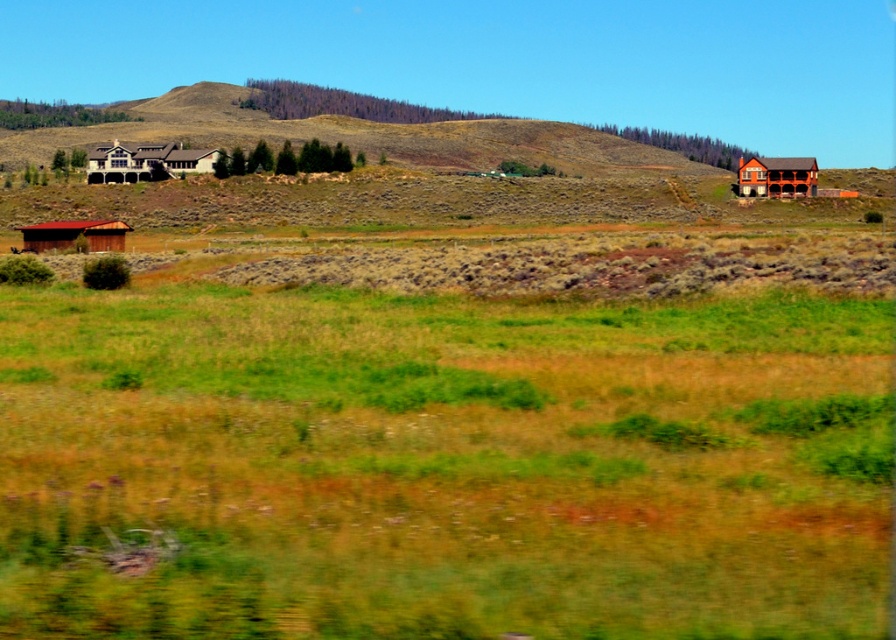
Does point (113, 180) lie in front of point (65, 228)?

No, (113, 180) is further to viewer.

Which of these two, white wood house at left or brown wooden hut at lower left, stands taller?

white wood house at left

Does point (112, 170) come in front of point (96, 221)?

No, it is behind (96, 221).

Image resolution: width=896 pixels, height=640 pixels. In order to click on white wood house at left in this screenshot , I will do `click(148, 161)`.

Is brown wooden house at right wider than brown wooden hut at lower left?

No, brown wooden house at right is not wider than brown wooden hut at lower left.

Does brown wooden house at right have a smaller size compared to brown wooden hut at lower left?

Yes, brown wooden house at right is smaller than brown wooden hut at lower left.

Find the location of a particular element. This screenshot has width=896, height=640. brown wooden house at right is located at coordinates (778, 177).

Locate an element on the screen. The image size is (896, 640). brown wooden house at right is located at coordinates (778, 177).

Does brown wooden hut at lower left appear on the left side of matte white house at upper left?

No, brown wooden hut at lower left is not to the left of matte white house at upper left.

The width and height of the screenshot is (896, 640). Identify the location of brown wooden hut at lower left. (75, 234).

You are a GUI agent. You are given a task and a screenshot of the screen. Output one action in this format:
    pyautogui.click(x=<x>, y=<y>)
    Task: Click on the brown wooden hut at lower left
    
    Given the screenshot: What is the action you would take?
    pyautogui.click(x=75, y=234)

You are a GUI agent. You are given a task and a screenshot of the screen. Output one action in this format:
    pyautogui.click(x=<x>, y=<y>)
    Task: Click on the brown wooden hut at lower left
    
    Given the screenshot: What is the action you would take?
    pyautogui.click(x=75, y=234)